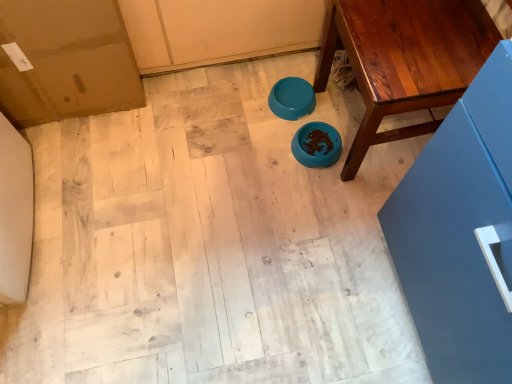
Question: Considering the positions of point (283, 99) and point (300, 150), is point (283, 99) closer or farther from the camera than point (300, 150)?

Choices:
 (A) closer
 (B) farther

Answer: (B)

Question: In terms of width, does teal glossy bowl at center, the first bowl when ordered from top to bottom, look wider or thinner when compared to blue matte bowl at center, the second bowl in the top-to-bottom sequence?

Choices:
 (A) thin
 (B) wide

Answer: (A)

Question: Estimate the real-world distances between objects in this image. Which object is closer to the wooden table at center?

Choices:
 (A) blue matte bowl at center, marked as the 1th bowl in a bottom-to-top arrangement
 (B) teal glossy bowl at center, which appears as the second bowl when ordered from the bottom

Answer: (A)

Question: Which object is positioned closest to the blue matte bowl at center, the second bowl in the top-to-bottom sequence?

Choices:
 (A) wooden table at center
 (B) teal glossy bowl at center, which appears as the second bowl when ordered from the bottom

Answer: (B)